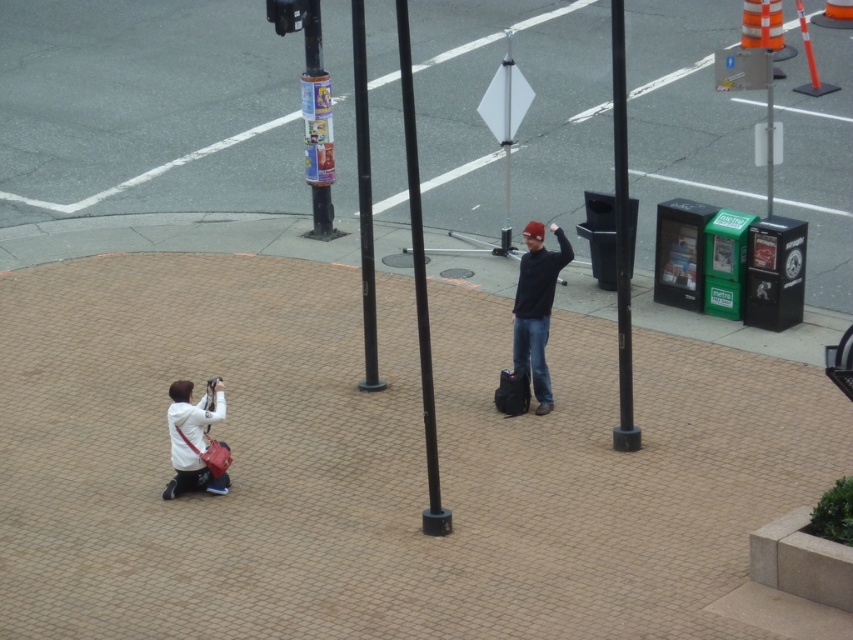
You are a city planner assessing the structural integrity of the poles in the urban scene. Given that the black plastic pole at center is wider than the black metal pole at center, which pole would you recommend for supporting heavy signage, and why?

The black plastic pole at center is wider than the black metal pole at center, so it would be more suitable for supporting heavy signage due to its greater width providing better stability.

Looking at this image, you are standing on the balcony and want to place a 1.2 meter long ladder between the matte black jacket at center and the black metal pole at center. Can the ladder fit between them without overlapping either object?

The distance between the matte black jacket at center and the black metal pole at center is 1.18 meters. Since the ladder is 1.2 meters long, it cannot fit between them without overlapping the objects.

You are standing on a balcony overlooking the urban scene described. You notice two poles at the center of the image. Which pole, the black matte pole at center or the smooth black pole at center, is taller?

The black matte pole at center is taller than the smooth black pole at center.